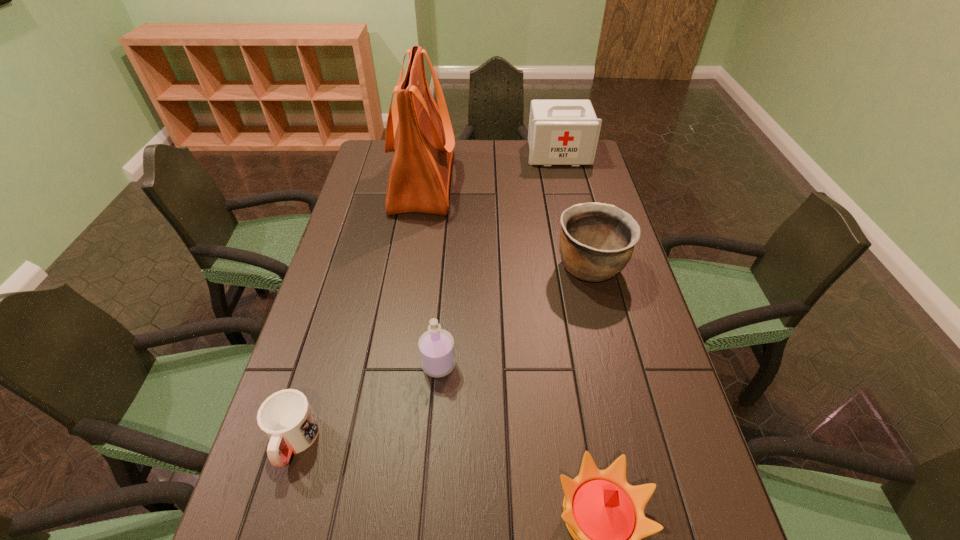
Locate an element on the screen. vacant space located on the side of the leftmost object with the handle is located at coordinates (275, 506).

You are a GUI agent. You are given a task and a screenshot of the screen. Output one action in this format:
    pyautogui.click(x=<x>, y=<y>)
    Task: Click on the shopping bag present at the far edge
    
    Given the screenshot: What is the action you would take?
    pyautogui.click(x=423, y=140)

At what (x,y) coordinates should I click in order to perform the action: click on the first-aid kit that is at the far edge. Please return your answer as a coordinate pair (x, y). Looking at the image, I should click on (x=561, y=132).

I want to click on shopping bag located at the left edge, so click(x=423, y=140).

The height and width of the screenshot is (540, 960). What are the coordinates of `mug that is at the left edge` in the screenshot? It's located at (286, 417).

Where is `the first-aid kit present at the right edge`? This screenshot has height=540, width=960. the first-aid kit present at the right edge is located at coordinates (561, 132).

This screenshot has width=960, height=540. What are the coordinates of `pottery located in the right edge section of the desktop` in the screenshot? It's located at (597, 240).

At what (x,y) coordinates should I click in order to perform the action: click on object at the far left corner. Please return your answer as a coordinate pair (x, y). The width and height of the screenshot is (960, 540). Looking at the image, I should click on (423, 140).

Where is `object that is at the far right corner`? The image size is (960, 540). object that is at the far right corner is located at coordinates (561, 132).

In the image, there is a desktop. Where is `vacant space at the far edge`? vacant space at the far edge is located at coordinates (491, 165).